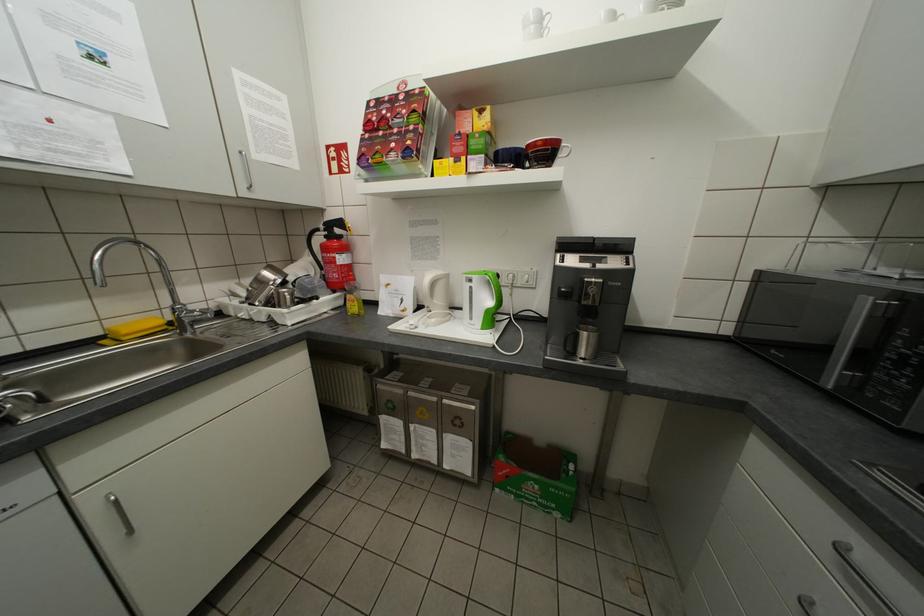
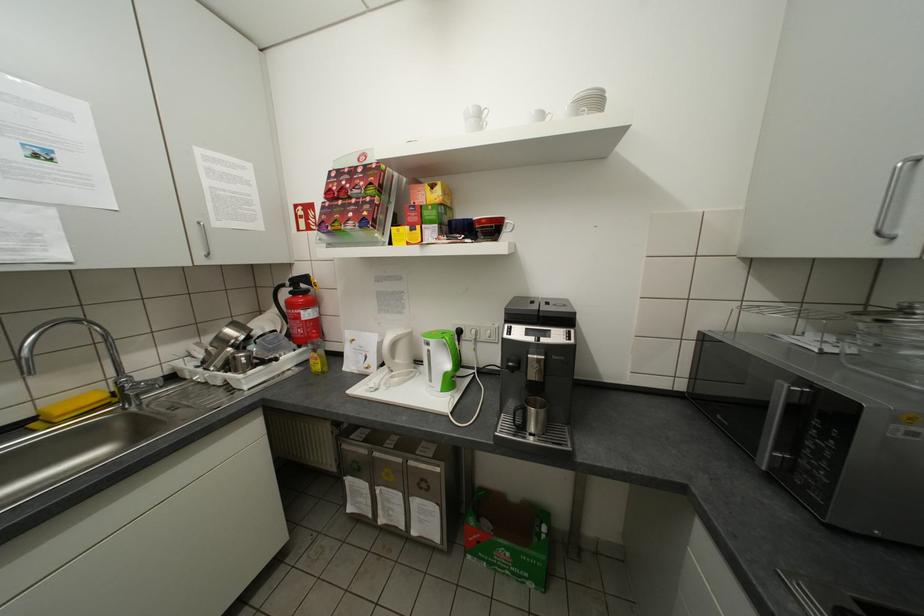
Find the pixel in the second image that matches (x=346, y=256) in the first image.

(310, 312)